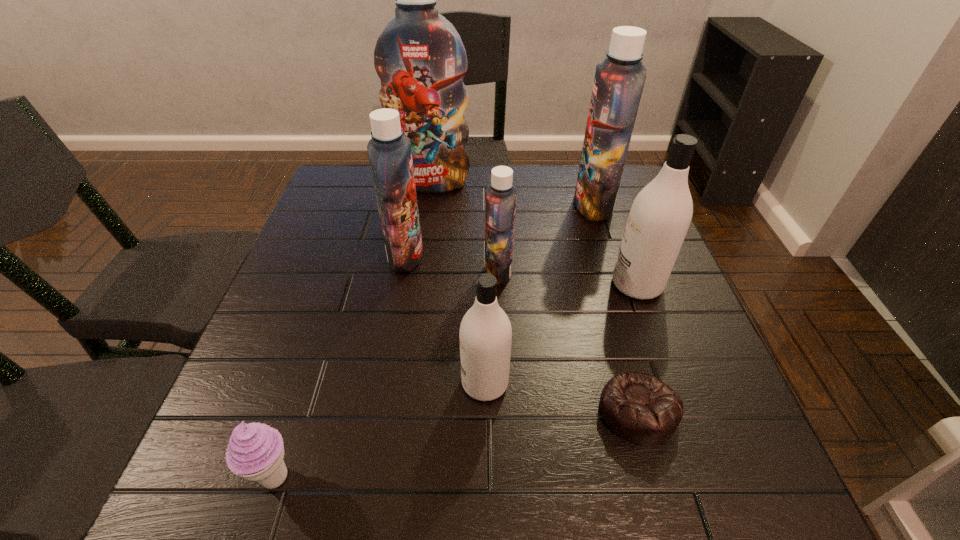
Identify the location of free region located on the front-facing side of the right white shampoo. (564, 285).

Find the location of `free location located on the front-facing side of the right white shampoo`. free location located on the front-facing side of the right white shampoo is located at coordinates (512, 285).

Locate an element on the screen. This screenshot has height=540, width=960. vacant space positioned 0.060m on the front label of the second blue shampoo from right to left is located at coordinates (459, 271).

Locate an element on the screen. free region located on the front label of the second blue shampoo from right to left is located at coordinates (367, 271).

Locate an element on the screen. This screenshot has width=960, height=540. free region located on the front label of the second blue shampoo from right to left is located at coordinates (321, 271).

You are a GUI agent. You are given a task and a screenshot of the screen. Output one action in this format:
    pyautogui.click(x=<x>, y=<y>)
    Task: Click on the free space located on the front-facing side of the nearer white shampoo
    
    Given the screenshot: What is the action you would take?
    pyautogui.click(x=435, y=383)

This screenshot has height=540, width=960. In order to click on free space located on the front-facing side of the nearer white shampoo in this screenshot , I will do `click(334, 383)`.

I want to click on free space located on the front-facing side of the nearer white shampoo, so click(280, 383).

At what (x,y) coordinates should I click in order to perform the action: click on vacant space located on the back of the nearest object. Please return your answer as a coordinate pair (x, y). This screenshot has height=540, width=960. Looking at the image, I should click on (310, 372).

Where is `vacant region located on the left of the brown beanbag`? The image size is (960, 540). vacant region located on the left of the brown beanbag is located at coordinates (504, 411).